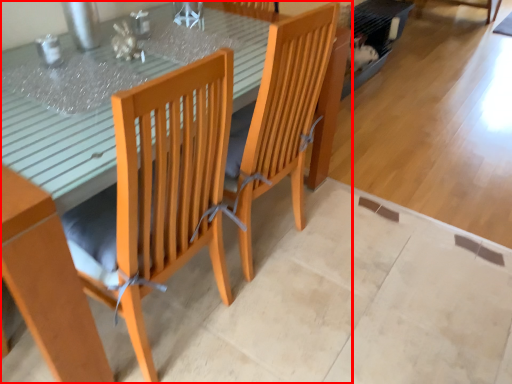
Question: From the image's perspective, where is table (annotated by the red box) located in relation to chair in the image?

Choices:
 (A) above
 (B) below

Answer: (B)